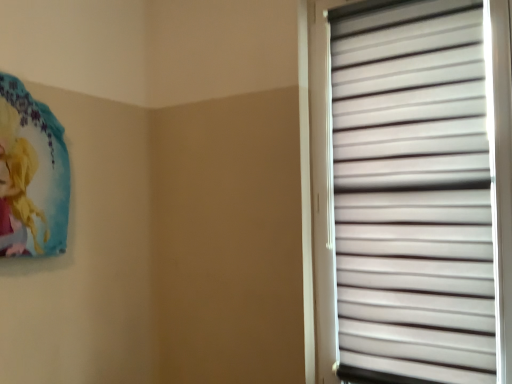
Question: From the image's perspective, is matte blue poster at upper left on white matte window blind at right?

Choices:
 (A) no
 (B) yes

Answer: (B)

Question: Is matte blue poster at upper left touching white matte window blind at right?

Choices:
 (A) no
 (B) yes

Answer: (A)

Question: Is matte blue poster at upper left bigger than white matte window blind at right?

Choices:
 (A) no
 (B) yes

Answer: (A)

Question: From the image's perspective, does matte blue poster at upper left appear lower than white matte window blind at right?

Choices:
 (A) no
 (B) yes

Answer: (A)

Question: Is matte blue poster at upper left thinner than white matte window blind at right?

Choices:
 (A) no
 (B) yes

Answer: (A)

Question: Is white matte window blind at right inside matte blue poster at upper left?

Choices:
 (A) no
 (B) yes

Answer: (A)

Question: Can you confirm if white matte window blind at right is shorter than matte blue poster at upper left?

Choices:
 (A) yes
 (B) no

Answer: (B)

Question: Is the position of white matte window blind at right more distant than that of matte blue poster at upper left?

Choices:
 (A) yes
 (B) no

Answer: (B)

Question: Does white matte window blind at right have a lesser width compared to matte blue poster at upper left?

Choices:
 (A) no
 (B) yes

Answer: (B)

Question: Is white matte window blind at right wider than matte blue poster at upper left?

Choices:
 (A) yes
 (B) no

Answer: (B)

Question: Is matte blue poster at upper left located within white matte window blind at right?

Choices:
 (A) no
 (B) yes

Answer: (A)

Question: Can you confirm if white matte window blind at right is positioned to the right of matte blue poster at upper left?

Choices:
 (A) yes
 (B) no

Answer: (A)

Question: Considering the positions of white matte window blind at right and matte blue poster at upper left in the image, is white matte window blind at right bigger or smaller than matte blue poster at upper left?

Choices:
 (A) small
 (B) big

Answer: (B)